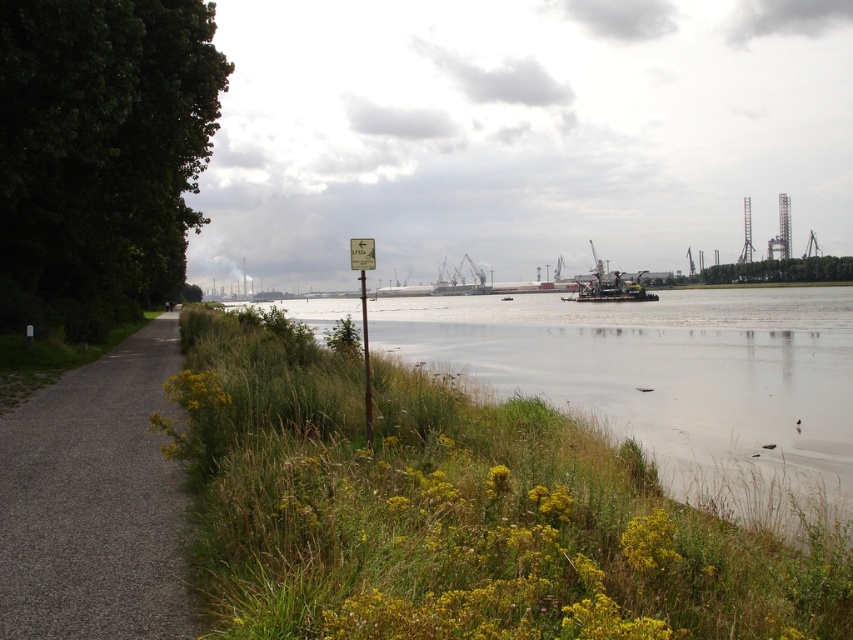
Is the position of gravel path at left less distant than that of green plastic sign at center?

Yes, it is.

Measure the distance between point (x=144, y=433) and camera.

The distance of point (x=144, y=433) from camera is 35.28 feet.

This screenshot has height=640, width=853. In order to click on gravel path at left in this screenshot , I will do [94, 500].